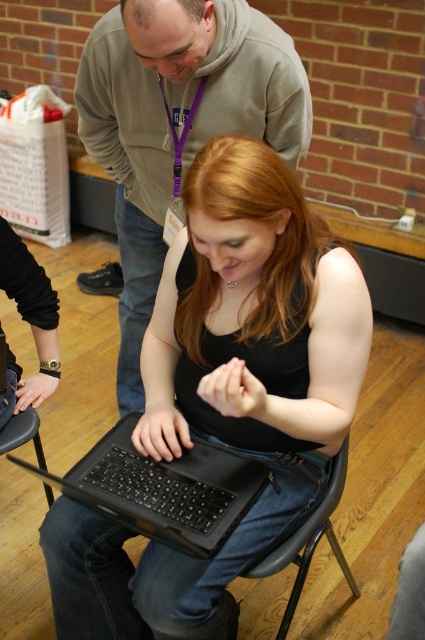
Question: Which point is farther from the camera taking this photo?

Choices:
 (A) (40, 465)
 (B) (248, 492)
 (C) (260, 115)

Answer: (A)

Question: Observing the image, what is the correct spatial positioning of black matte laptop at center in reference to black plastic chair at lower center?

Choices:
 (A) right
 (B) left

Answer: (B)

Question: Is gray hoodie at upper center above black plastic chair at lower center?

Choices:
 (A) no
 (B) yes

Answer: (B)

Question: Considering the relative positions of gray hoodie at upper center and black matte laptop at center in the image provided, where is gray hoodie at upper center located with respect to black matte laptop at center?

Choices:
 (A) right
 (B) left

Answer: (B)

Question: Among these points, which one is farthest from the camera?

Choices:
 (A) (289, 598)
 (B) (142, 102)
 (C) (76, 596)

Answer: (B)

Question: Among these points, which one is farthest from the camera?

Choices:
 (A) (28, 419)
 (B) (201, 161)
 (C) (306, 90)
 (D) (311, 518)

Answer: (A)